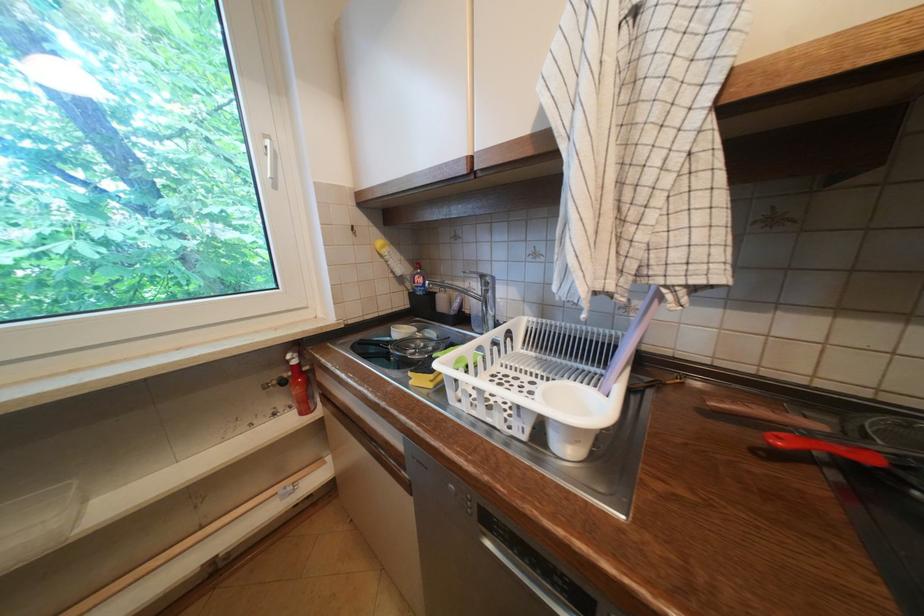
Describe the element at coordinates (270, 158) in the screenshot. I see `the white window handle` at that location.